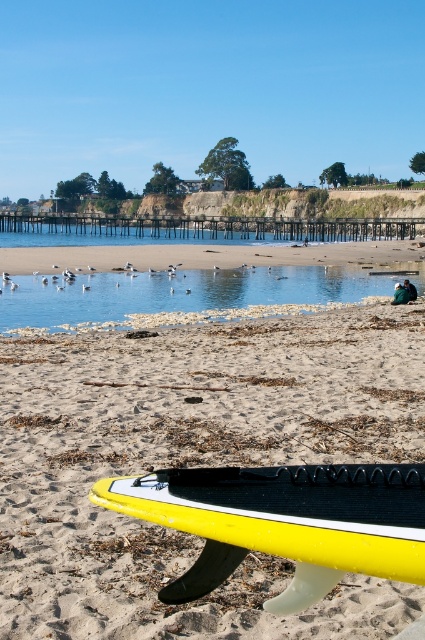
Looking at this image, does yellow foam surfboard at lower center have a lesser height compared to clear water at center?

Indeed, yellow foam surfboard at lower center has a lesser height compared to clear water at center.

Can you confirm if yellow foam surfboard at lower center is positioned to the right of clear water at center?

Indeed, yellow foam surfboard at lower center is positioned on the right side of clear water at center.

Does point (189, 484) come farther from viewer compared to point (116, 276)?

No, (189, 484) is closer to viewer.

This screenshot has width=425, height=640. Find the location of `yellow foam surfboard at lower center`. yellow foam surfboard at lower center is located at coordinates [x=283, y=520].

Is yellow matte surfboard at lower center shorter than clear water at center?

Yes.

Between yellow matte surfboard at lower center and clear water at center, which one has more height?

Standing taller between the two is clear water at center.

You are a GUI agent. You are given a task and a screenshot of the screen. Output one action in this format:
    pyautogui.click(x=<x>, y=<y>)
    Task: Click on the yellow matte surfboard at lower center
    
    Given the screenshot: What is the action you would take?
    pyautogui.click(x=192, y=465)

Locate an element on the screen. The height and width of the screenshot is (640, 425). yellow matte surfboard at lower center is located at coordinates click(x=192, y=465).

Does yellow matte surfboard at lower center have a lesser height compared to yellow foam surfboard at lower center?

No, yellow matte surfboard at lower center is not shorter than yellow foam surfboard at lower center.

This screenshot has width=425, height=640. What do you see at coordinates (192, 465) in the screenshot? I see `yellow matte surfboard at lower center` at bounding box center [192, 465].

Find the location of `yellow matte surfboard at lower center`. yellow matte surfboard at lower center is located at coordinates (192, 465).